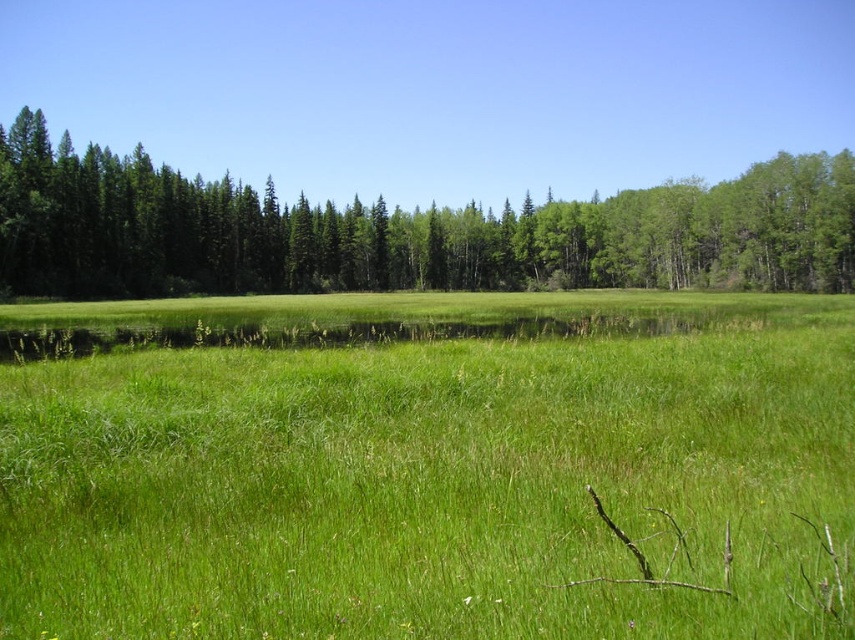
Looking at this image, you are standing at the edge of the water in the serene natural landscape. You see two points marked on the image. Which point is closer to you, point (239, 550) or point (207, 211)?

Point (239, 550) is in front of point (207, 211), so it is closer to you.

You are standing in the serene natural landscape and want to walk from the green matte trees at center to the green grassy field at center. In which direction should you move?

The green grassy field at center is to the right of the green matte trees at center, so you should move to the right to reach it.